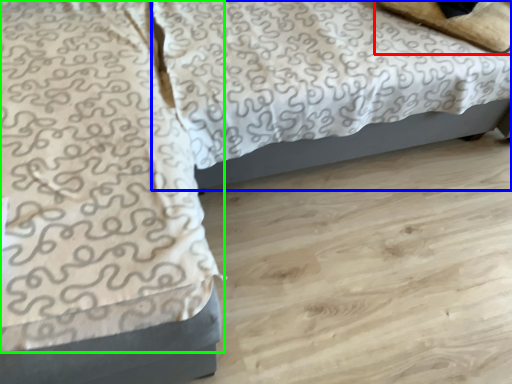
Question: Estimate the real-world distances between objects in this image. Which object is farther from pillow (highlighted by a red box), bed (highlighted by a blue box) or blanket (highlighted by a green box)?

Choices:
 (A) bed
 (B) blanket

Answer: (B)